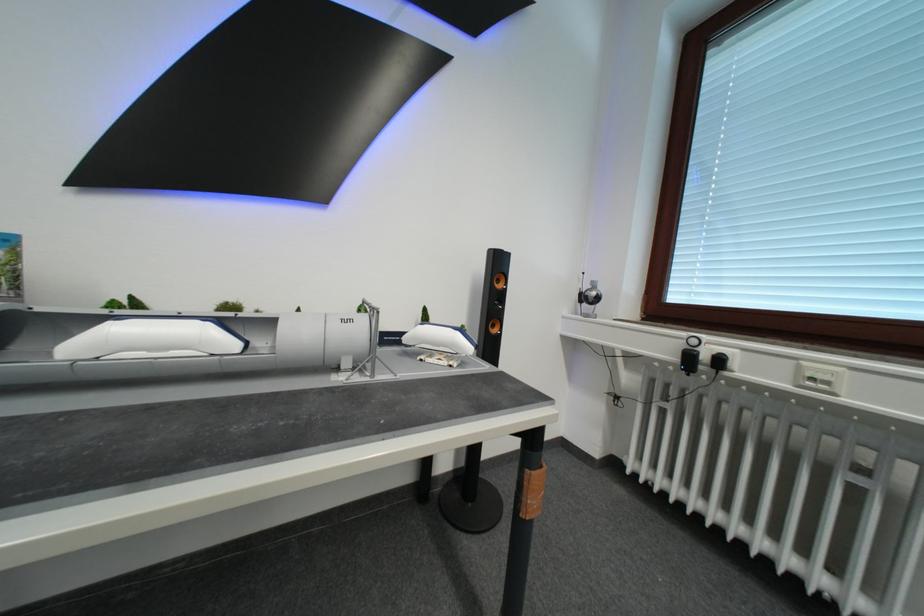
What do you see at coordinates (820, 378) in the screenshot? I see `the green light switch` at bounding box center [820, 378].